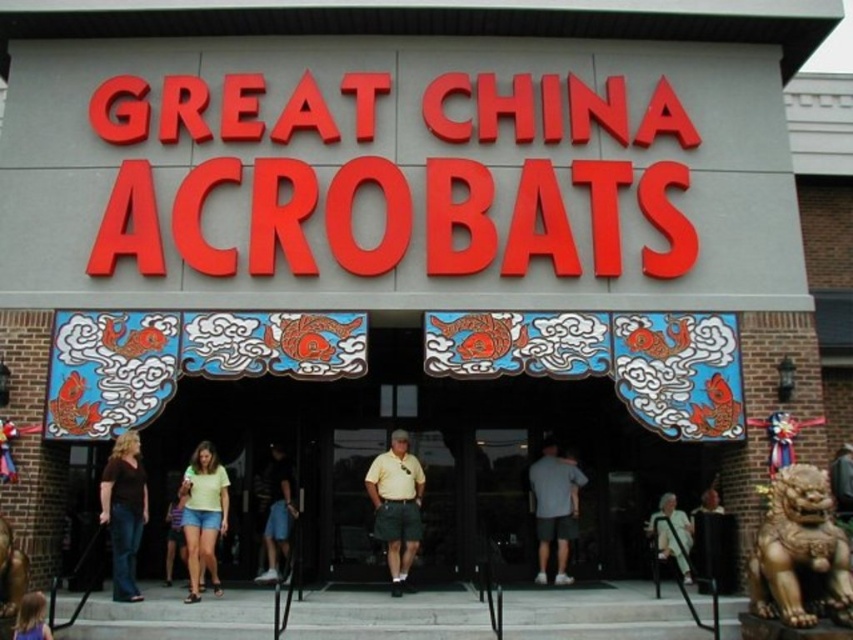
Between dark blue shorts at center and white fabric at lower right, which one is positioned higher?

dark blue shorts at center

Is dark blue shorts at center positioned at the back of white fabric at lower right?

Yes, it is behind white fabric at lower right.

Who is more forward, (265, 550) or (682, 570)?

Point (682, 570) is in front.

Locate an element on the screen. dark blue shorts at center is located at coordinates (277, 512).

How much distance is there between gray fabric shirt at center and white fabric at lower right?

5.29 meters

Measure the distance between point (543, 550) and camera.

The distance of point (543, 550) from camera is 43.75 meters.

Does point (561, 540) lie in front of point (675, 541)?

No, (561, 540) is behind (675, 541).

Where is `gray fabric shirt at center`? The image size is (853, 640). gray fabric shirt at center is located at coordinates (554, 508).

Is light green fabric shirt at center to the right of light brown hair at lower left from the viewer's perspective?

Correct, you'll find light green fabric shirt at center to the right of light brown hair at lower left.

Is light green fabric shirt at center thinner than light brown hair at lower left?

Yes, light green fabric shirt at center is thinner than light brown hair at lower left.

What do you see at coordinates (202, 515) in the screenshot? I see `light green fabric shirt at center` at bounding box center [202, 515].

At what (x,y) coordinates should I click in order to perform the action: click on light green fabric shirt at center. Please return your answer as a coordinate pair (x, y). Looking at the image, I should click on (202, 515).